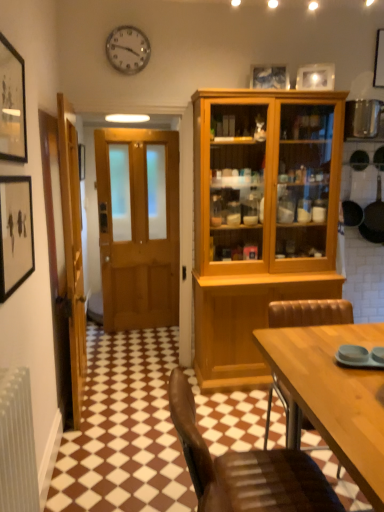
Question: Is white glossy picture frame at upper center, which is counted as the 1th picture frame, starting from the back, shorter than black non-stick frying pan at right?

Choices:
 (A) yes
 (B) no

Answer: (A)

Question: From a real-world perspective, is white glossy picture frame at upper center, which is counted as the 1th picture frame, starting from the back, on top of black non-stick frying pan at right?

Choices:
 (A) no
 (B) yes

Answer: (B)

Question: Is white glossy picture frame at upper center, positioned as the first picture frame in right-to-left order, turned away from black non-stick frying pan at right?

Choices:
 (A) no
 (B) yes

Answer: (A)

Question: Is white glossy picture frame at upper center, the third picture frame when ordered from bottom to top, next to black non-stick frying pan at right and touching it?

Choices:
 (A) yes
 (B) no

Answer: (B)

Question: Would you consider white glossy picture frame at upper center, which is counted as the 1th picture frame, starting from the back, to be distant from black non-stick frying pan at right?

Choices:
 (A) no
 (B) yes

Answer: (B)

Question: From a real-world perspective, relative to matte black picture frame at left, the 4th picture frame positioned from the right, is metallic clock at upper center vertically above or below?

Choices:
 (A) above
 (B) below

Answer: (A)

Question: Looking at the image, does metallic clock at upper center seem bigger or smaller compared to matte black picture frame at left, the 4th picture frame positioned from the right?

Choices:
 (A) big
 (B) small

Answer: (B)

Question: Would you say metallic clock at upper center is inside or outside matte black picture frame at left, positioned as the 1th picture frame in bottom-to-top order?

Choices:
 (A) outside
 (B) inside

Answer: (A)

Question: Relative to matte black picture frame at left, which ranks as the 4th picture frame in top-to-bottom order, is metallic clock at upper center in front or behind?

Choices:
 (A) behind
 (B) front

Answer: (A)

Question: From the image's perspective, is matte black picture frame at left, positioned as the 1th picture frame in bottom-to-top order, located above or below white glossy picture frame at upper center, which is counted as the 1th picture frame, starting from the back?

Choices:
 (A) above
 (B) below

Answer: (B)

Question: Is matte black picture frame at left, which ranks as the 4th picture frame in top-to-bottom order, in front of or behind white glossy picture frame at upper center, the third picture frame when ordered from bottom to top, in the image?

Choices:
 (A) front
 (B) behind

Answer: (A)

Question: Would you say matte black picture frame at left, which ranks as the 4th picture frame in top-to-bottom order, is to the left or to the right of white glossy picture frame at upper center, which is the fourth picture frame from front to back, in the picture?

Choices:
 (A) right
 (B) left

Answer: (B)

Question: From a real-world perspective, is matte black picture frame at left, which ranks as the 4th picture frame in top-to-bottom order, above or below white glossy picture frame at upper center, which is the 4th picture frame in left-to-right order?

Choices:
 (A) above
 (B) below

Answer: (B)

Question: Choose the correct answer: Is brown leather chair at lower center, which is counted as the 1th chair, starting from the front, inside matte wooden picture frame at upper center, marked as the third picture frame in a front-to-back arrangement, or outside it?

Choices:
 (A) outside
 (B) inside

Answer: (A)

Question: Based on their sizes in the image, would you say brown leather chair at lower center, which is counted as the 1th chair, starting from the front, is bigger or smaller than matte wooden picture frame at upper center, placed as the 1th picture frame when sorted from top to bottom?

Choices:
 (A) small
 (B) big

Answer: (B)